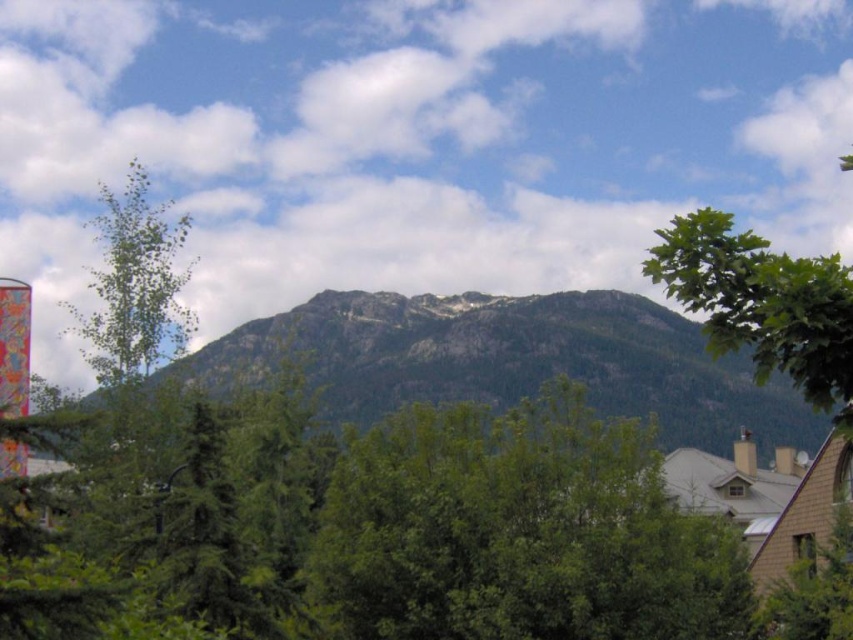
Question: Estimate the real-world distances between objects in this image. Which object is closer to the green leafy tree at center?

Choices:
 (A) rocky gray mountain at center
 (B) green leafy tree at upper right

Answer: (B)

Question: Which of the following is the closest to the observer?

Choices:
 (A) rocky gray mountain at center
 (B) green leafy tree at center
 (C) green leafy tree at upper right

Answer: (C)

Question: Does rocky gray mountain at center appear on the left side of green leafy tree at upper right?

Choices:
 (A) yes
 (B) no

Answer: (A)

Question: Does green leafy tree at center appear over green leafy tree at upper right?

Choices:
 (A) yes
 (B) no

Answer: (B)

Question: Is rocky gray mountain at center below green leafy tree at upper right?

Choices:
 (A) no
 (B) yes

Answer: (B)

Question: Which point is closer to the camera?

Choices:
 (A) green leafy tree at upper right
 (B) green leafy tree at center
 (C) rocky gray mountain at center

Answer: (A)